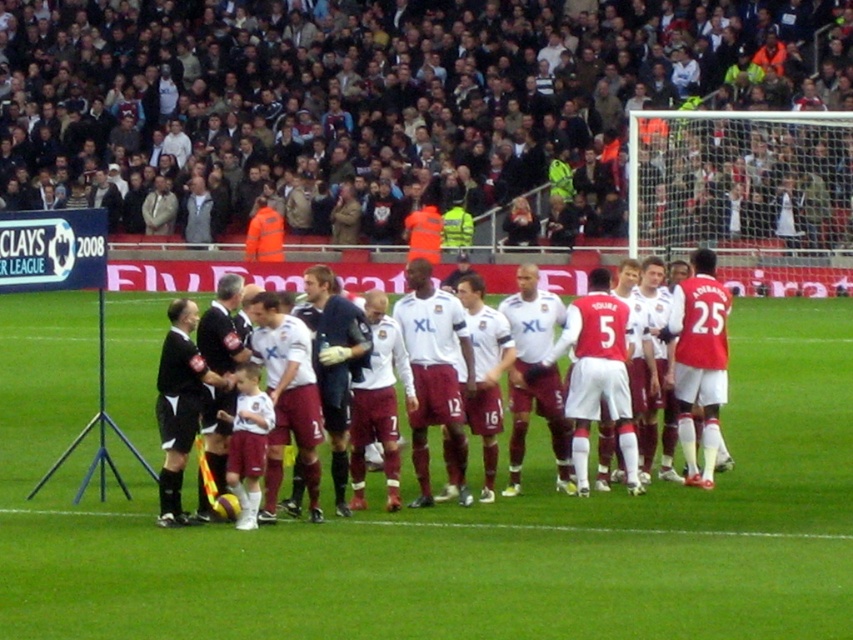
Question: Which of the following is the closest to the observer?

Choices:
 (A) (155, 561)
 (B) (798, 538)

Answer: (A)

Question: Considering the real-world distances, which object is closest to the white smooth soccer field at center?

Choices:
 (A) white smooth soccer ball at center
 (B) brown leather jacket at upper center

Answer: (A)

Question: From the image, what is the correct spatial relationship of brown leather jacket at upper center in relation to black jersey at center?

Choices:
 (A) left
 (B) right

Answer: (B)

Question: Among these objects, which one is nearest to the camera?

Choices:
 (A) maroon jersey at center
 (B) black jersey at center

Answer: (B)

Question: Does white matte jersey at center have a lesser width compared to white smooth soccer ball at center?

Choices:
 (A) no
 (B) yes

Answer: (A)

Question: Can you confirm if brown leather jacket at upper center is bigger than white smooth soccer ball at center?

Choices:
 (A) no
 (B) yes

Answer: (B)